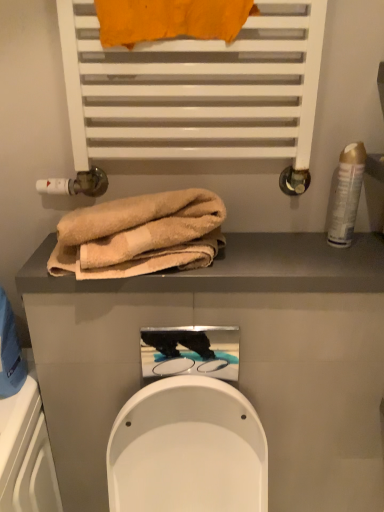
Question: Could you tell me if orange fabric towel at upper center, marked as the first towel in a top-to-bottom arrangement, is turned towards beige towel at upper center?

Choices:
 (A) yes
 (B) no

Answer: (B)

Question: Does orange fabric towel at upper center, marked as the first towel in a top-to-bottom arrangement, have a lesser height compared to beige towel at upper center?

Choices:
 (A) yes
 (B) no

Answer: (B)

Question: Is the position of orange fabric towel at upper center, marked as the first towel in a top-to-bottom arrangement, less distant than that of beige towel at upper center?

Choices:
 (A) no
 (B) yes

Answer: (B)

Question: Can you confirm if orange fabric towel at upper center, marked as the first towel in a top-to-bottom arrangement, is taller than beige towel at upper center?

Choices:
 (A) no
 (B) yes

Answer: (B)

Question: From a real-world perspective, is orange fabric towel at upper center, which is counted as the second towel, starting from the bottom, positioned under beige towel at upper center based on gravity?

Choices:
 (A) no
 (B) yes

Answer: (A)

Question: In terms of height, does beige soft towel at center, the 1th towel in the bottom-to-top sequence, look taller or shorter compared to gold metallic can at right?

Choices:
 (A) tall
 (B) short

Answer: (B)

Question: From a real-world perspective, is beige soft towel at center, the 1th towel in the bottom-to-top sequence, above or below gold metallic can at right?

Choices:
 (A) above
 (B) below

Answer: (B)

Question: Does point (134, 216) appear closer or farther from the camera than point (352, 217)?

Choices:
 (A) closer
 (B) farther

Answer: (A)

Question: Do you think beige soft towel at center, the 1th towel in the bottom-to-top sequence, is within gold metallic can at right, or outside of it?

Choices:
 (A) outside
 (B) inside

Answer: (A)

Question: From the image's perspective, is beige soft towel at center, the 2th towel when ordered from top to bottom, located above or below orange fabric towel at upper center, which is counted as the second towel, starting from the bottom?

Choices:
 (A) above
 (B) below

Answer: (B)

Question: Is beige soft towel at center, the 2th towel when ordered from top to bottom, inside or outside of orange fabric towel at upper center, which is counted as the second towel, starting from the bottom?

Choices:
 (A) outside
 (B) inside

Answer: (A)

Question: Is beige soft towel at center, the 2th towel when ordered from top to bottom, to the left or to the right of orange fabric towel at upper center, marked as the first towel in a top-to-bottom arrangement, in the image?

Choices:
 (A) left
 (B) right

Answer: (A)

Question: Considering the positions of beige soft towel at center, the 2th towel when ordered from top to bottom, and orange fabric towel at upper center, marked as the first towel in a top-to-bottom arrangement, in the image, is beige soft towel at center, the 2th towel when ordered from top to bottom, taller or shorter than orange fabric towel at upper center, marked as the first towel in a top-to-bottom arrangement,?

Choices:
 (A) short
 (B) tall

Answer: (B)

Question: Relative to white matte towel rack at upper center, is orange fabric towel at upper center, which is counted as the second towel, starting from the bottom, in front or behind?

Choices:
 (A) behind
 (B) front

Answer: (B)

Question: From their relative heights in the image, would you say orange fabric towel at upper center, marked as the first towel in a top-to-bottom arrangement, is taller or shorter than white matte towel rack at upper center?

Choices:
 (A) tall
 (B) short

Answer: (B)